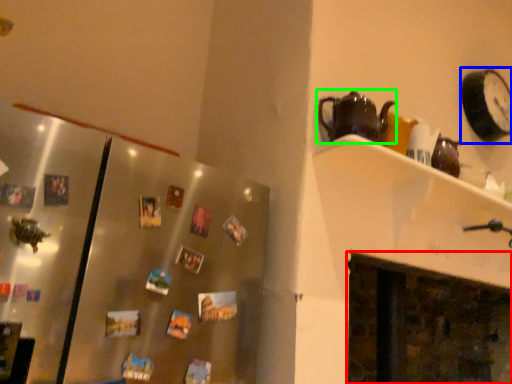
Question: Estimate the real-world distances between objects in this image. Which object is farther from fireplace (highlighted by a red box), clock (highlighted by a blue box) or kettle (highlighted by a green box)?

Choices:
 (A) clock
 (B) kettle

Answer: (B)